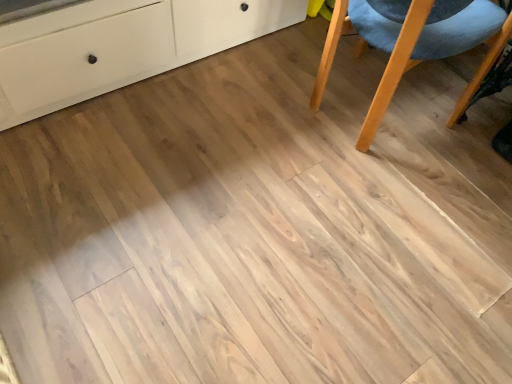
In the scene shown: What is the approximate height of matte white cabinet at upper left?

matte white cabinet at upper left is 20.93 inches tall.

Measure the distance between point (x=20, y=91) and camera.

A distance of 4.74 feet exists between point (x=20, y=91) and camera.

What do you see at coordinates (120, 46) in the screenshot?
I see `matte white cabinet at upper left` at bounding box center [120, 46].

Measure the distance between matte white cabinet at upper left and camera.

A distance of 4.20 feet exists between matte white cabinet at upper left and camera.

This screenshot has width=512, height=384. I want to click on matte white cabinet at upper left, so click(120, 46).

The height and width of the screenshot is (384, 512). I want to click on light wood chair at right, so pos(412,48).

What do you see at coordinates (412, 48) in the screenshot? The height and width of the screenshot is (384, 512). I see `light wood chair at right` at bounding box center [412, 48].

The image size is (512, 384). I want to click on matte white cabinet at upper left, so click(x=120, y=46).

Which object is positioned more to the right, matte white cabinet at upper left or light wood chair at right?

light wood chair at right is more to the right.

Is matte white cabinet at upper left positioned in front of light wood chair at right?

Yes.

Which point is more forward, (187, 6) or (330, 33)?

The point (330, 33) is in front.

From the image's perspective, is matte white cabinet at upper left above or below light wood chair at right?

From the image's perspective, matte white cabinet at upper left appears above light wood chair at right.

From a real-world perspective, which is physically below, matte white cabinet at upper left or light wood chair at right?

matte white cabinet at upper left, from a real-world perspective.

Is matte white cabinet at upper left wider or thinner than light wood chair at right?

Considering their sizes, matte white cabinet at upper left looks broader than light wood chair at right.

Does matte white cabinet at upper left have a lesser height compared to light wood chair at right?

Indeed, matte white cabinet at upper left has a lesser height compared to light wood chair at right.

Which of these two, matte white cabinet at upper left or light wood chair at right, is bigger?

matte white cabinet at upper left.

Is matte white cabinet at upper left outside of light wood chair at right?

Indeed, matte white cabinet at upper left is completely outside light wood chair at right.

Is matte white cabinet at upper left touching light wood chair at right?

No, matte white cabinet at upper left is not next to light wood chair at right.

Is matte white cabinet at upper left facing towards light wood chair at right?

Yes, matte white cabinet at upper left is oriented towards light wood chair at right.

What's the angular difference between matte white cabinet at upper left and light wood chair at right's facing directions?

90.6 degrees.

You are a GUI agent. You are given a task and a screenshot of the screen. Output one action in this format:
    pyautogui.click(x=<x>, y=<y>)
    Task: Click on the chair above the matte white cabinet at upper left (from a real-world perspective)
    This screenshot has width=512, height=384.
    Given the screenshot: What is the action you would take?
    pyautogui.click(x=412, y=48)

Is light wood chair at right to the left or to the right of matte white cabinet at upper left in the image?

From the image, it's evident that light wood chair at right is to the right of matte white cabinet at upper left.

Is light wood chair at right positioned in front of matte white cabinet at upper left?

That is False.

Does point (350, 3) appear closer or farther from the camera than point (26, 82)?

Clearly, point (350, 3) is closer to the camera than point (26, 82).

From the image's perspective, who appears lower, light wood chair at right or matte white cabinet at upper left?

From the image's view, light wood chair at right is below.

From a real-world perspective, which object rests below the other?

matte white cabinet at upper left, from a real-world perspective.

Is light wood chair at right wider than matte white cabinet at upper left?

No.

Can you confirm if light wood chair at right is taller than matte white cabinet at upper left?

Correct, light wood chair at right is much taller as matte white cabinet at upper left.

Considering the relative sizes of light wood chair at right and matte white cabinet at upper left in the image provided, is light wood chair at right bigger than matte white cabinet at upper left?

No.

Is light wood chair at right inside the boundaries of matte white cabinet at upper left, or outside?

light wood chair at right exists outside the volume of matte white cabinet at upper left.

Is light wood chair at right next to matte white cabinet at upper left?

They are not placed beside each other.

Is light wood chair at right turned away from matte white cabinet at upper left?

No, light wood chair at right's orientation is not away from matte white cabinet at upper left.

Can you tell me how much light wood chair at right and matte white cabinet at upper left differ in facing direction?

90.6 degrees separate the facing orientations of light wood chair at right and matte white cabinet at upper left.

I want to click on chest of drawers below the light wood chair at right (from a real-world perspective), so click(x=120, y=46).

The width and height of the screenshot is (512, 384). I want to click on chair above the matte white cabinet at upper left (from a real-world perspective), so click(x=412, y=48).

Where is `the chest of drawers beneath the light wood chair at right (from a real-world perspective)`? Image resolution: width=512 pixels, height=384 pixels. the chest of drawers beneath the light wood chair at right (from a real-world perspective) is located at coordinates (120, 46).